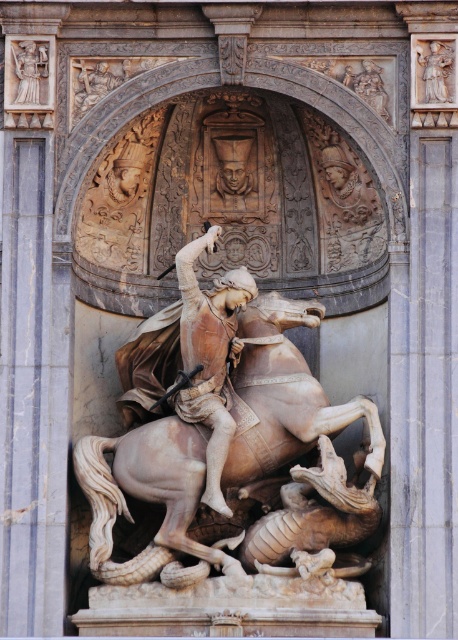
You are an art conservator measuring the spacing between two elements in a sculptural relief. You have a measuring tape that can extend up to 7 feet. You need to determine if the distance between the polished marble statue at upper right and the polished marble figures at upper right can be measured with your tape. Can you do it?

The distance between the polished marble statue at upper right and the polished marble figures at upper right is 7.78 feet. Since your measuring tape can only extend up to 7 feet, it is not long enough to measure the full distance between them.